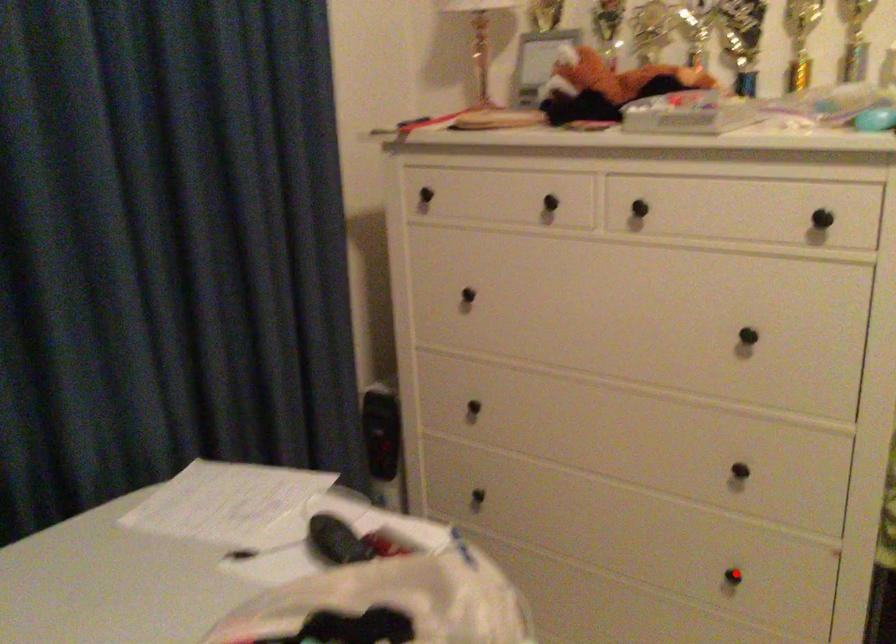
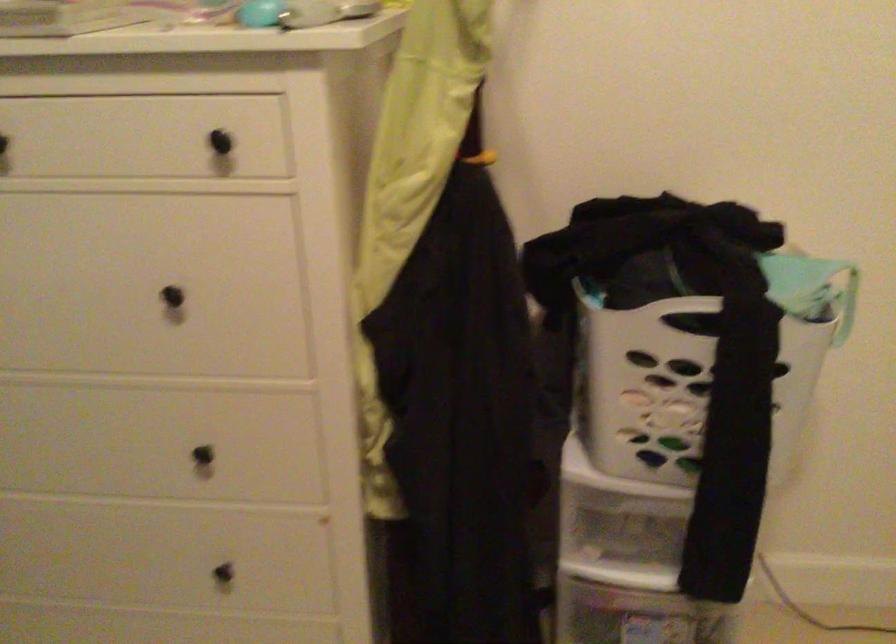
The point at the highlighted location is marked in the first image. Where is the corresponding point in the second image?

(226, 564)